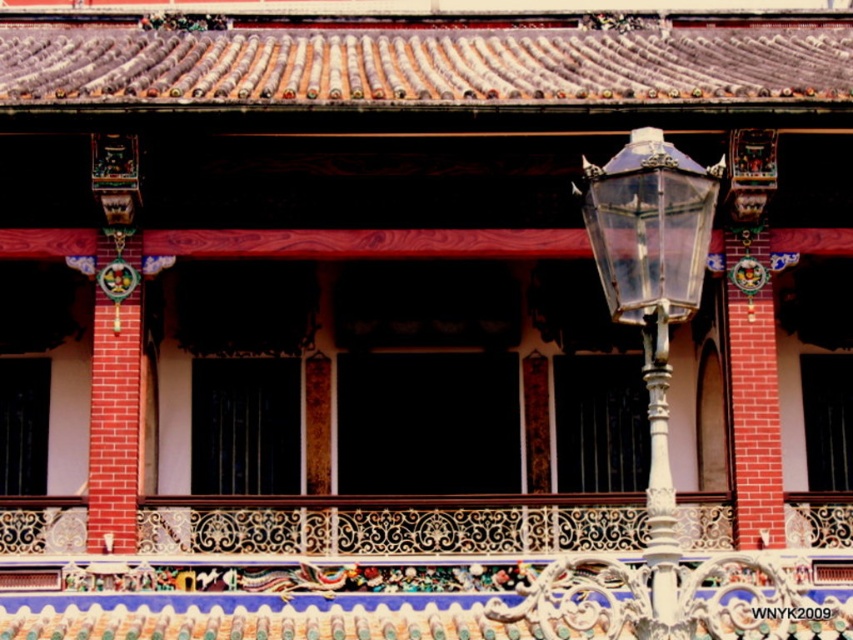
Question: Which object appears closest to the camera in this image?

Choices:
 (A) white metal pole at right
 (B) decorative wrought iron balcony at center
 (C) clear glass lantern at right

Answer: (B)

Question: Which point is farther from the camera taking this photo?

Choices:
 (A) (654, 486)
 (B) (660, 179)
 (C) (296, 570)

Answer: (C)

Question: Can you confirm if decorative wrought iron balcony at center is positioned to the left of clear glass lamp post at right?

Choices:
 (A) no
 (B) yes

Answer: (B)

Question: Is clear glass lamp post at right positioned in front of clear glass lantern at right?

Choices:
 (A) no
 (B) yes

Answer: (B)

Question: Which point appears closest to the camera in this image?

Choices:
 (A) (605, 243)
 (B) (651, 572)
 (C) (657, 154)

Answer: (B)

Question: Is clear glass lamp post at right thinner than white metal pole at right?

Choices:
 (A) no
 (B) yes

Answer: (A)